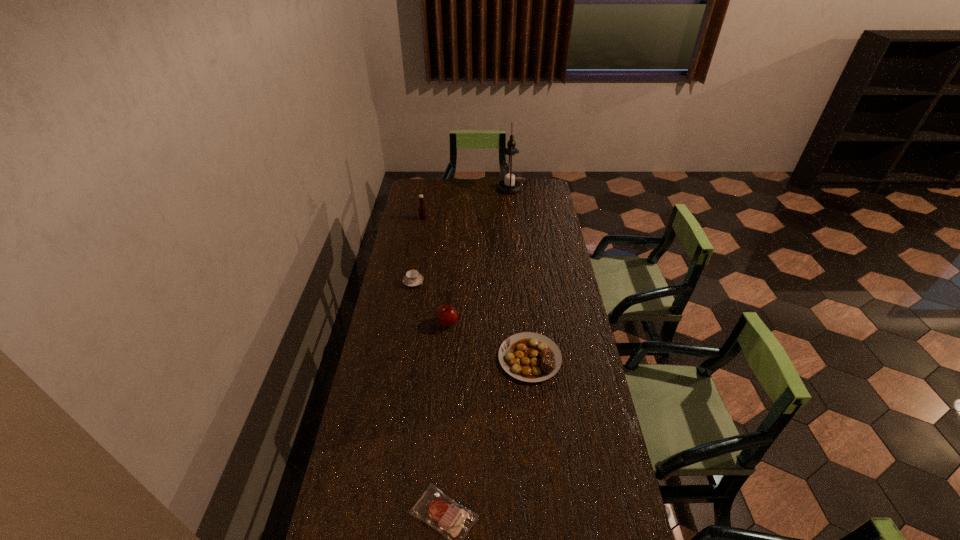
The image size is (960, 540). I want to click on the tallest object, so click(x=510, y=171).

Find the location of a particular element. oil lamp is located at coordinates (510, 171).

Locate an element on the screen. This screenshot has width=960, height=540. Tabasco sauce is located at coordinates (421, 208).

Locate an element on the screen. This screenshot has height=540, width=960. the second farthest object is located at coordinates (421, 208).

Identify the location of the fourth shortest object. Image resolution: width=960 pixels, height=540 pixels. (x=446, y=315).

You are a GUI agent. You are given a task and a screenshot of the screen. Output one action in this format:
    pyautogui.click(x=<x>, y=<y>)
    Task: Click on the apple
    Image resolution: width=960 pixels, height=540 pixels.
    Given the screenshot: What is the action you would take?
    pyautogui.click(x=446, y=315)

You are a GUI agent. You are given a task and a screenshot of the screen. Output one action in this format:
    pyautogui.click(x=<x>, y=<y>)
    Task: Click on the fourth nearest object
    This screenshot has width=960, height=540.
    Given the screenshot: What is the action you would take?
    pyautogui.click(x=412, y=278)

This screenshot has height=540, width=960. I want to click on the right steak, so click(x=530, y=357).

The width and height of the screenshot is (960, 540). Identify the location of the farther steak. (530, 357).

Locate an element on the screen. This screenshot has height=540, width=960. blank space located 0.290m on the left of the tallest object is located at coordinates (447, 188).